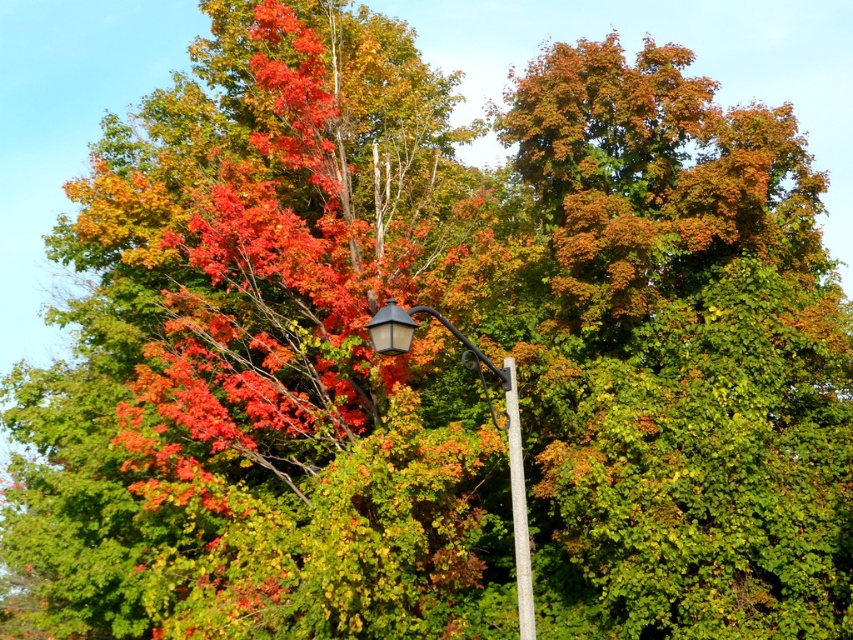
Question: Can you confirm if matte black street light at center is positioned to the left of white smooth pole at center?

Choices:
 (A) yes
 (B) no

Answer: (A)

Question: Which object is closer to the camera taking this photo?

Choices:
 (A) white smooth pole at center
 (B) matte black street light at center

Answer: (B)

Question: Which point is closer to the camera taking this photo?

Choices:
 (A) (511, 452)
 (B) (529, 600)

Answer: (B)

Question: Is matte black street light at center above white smooth pole at center?

Choices:
 (A) yes
 (B) no

Answer: (A)

Question: Is matte black street light at center to the left of white smooth pole at center from the viewer's perspective?

Choices:
 (A) no
 (B) yes

Answer: (B)

Question: Which object is closer to the camera taking this photo?

Choices:
 (A) white smooth pole at center
 (B) matte black street light at center

Answer: (B)